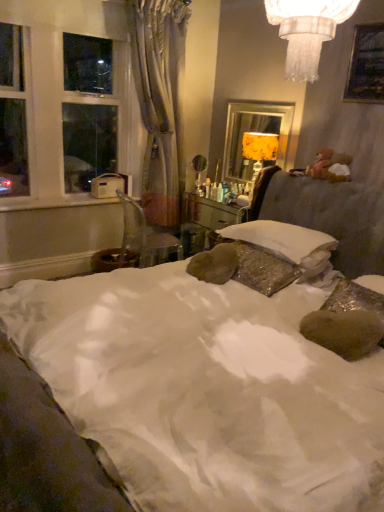
Question: Can you see white soft pillow at center touching white plastic window sill at left?

Choices:
 (A) no
 (B) yes

Answer: (A)

Question: Does white soft pillow at center have a smaller size compared to white plastic window sill at left?

Choices:
 (A) yes
 (B) no

Answer: (B)

Question: Can you confirm if white soft pillow at center is shorter than white plastic window sill at left?

Choices:
 (A) yes
 (B) no

Answer: (B)

Question: Is white soft pillow at center not inside white plastic window sill at left?

Choices:
 (A) no
 (B) yes

Answer: (B)

Question: From the image's perspective, is white soft pillow at center on white plastic window sill at left?

Choices:
 (A) yes
 (B) no

Answer: (B)

Question: Considering the relative sizes of white soft pillow at center and white plastic window sill at left in the image provided, is white soft pillow at center bigger than white plastic window sill at left?

Choices:
 (A) yes
 (B) no

Answer: (A)

Question: Does silvery drapery at left have a greater height compared to white plastic window sill at left?

Choices:
 (A) no
 (B) yes

Answer: (B)

Question: Can you confirm if silvery drapery at left is positioned to the left of white plastic window sill at left?

Choices:
 (A) yes
 (B) no

Answer: (B)

Question: Is the position of silvery drapery at left more distant than that of white plastic window sill at left?

Choices:
 (A) yes
 (B) no

Answer: (B)

Question: Considering the relative sizes of silvery drapery at left and white plastic window sill at left in the image provided, is silvery drapery at left bigger than white plastic window sill at left?

Choices:
 (A) yes
 (B) no

Answer: (A)

Question: From the image's perspective, is silvery drapery at left located above white plastic window sill at left?

Choices:
 (A) no
 (B) yes

Answer: (B)

Question: Is silvery drapery at left not near white plastic window sill at left?

Choices:
 (A) yes
 (B) no

Answer: (B)

Question: Is white satin bed at center positioned with its back to gold textured lampshade at upper right?

Choices:
 (A) yes
 (B) no

Answer: (B)